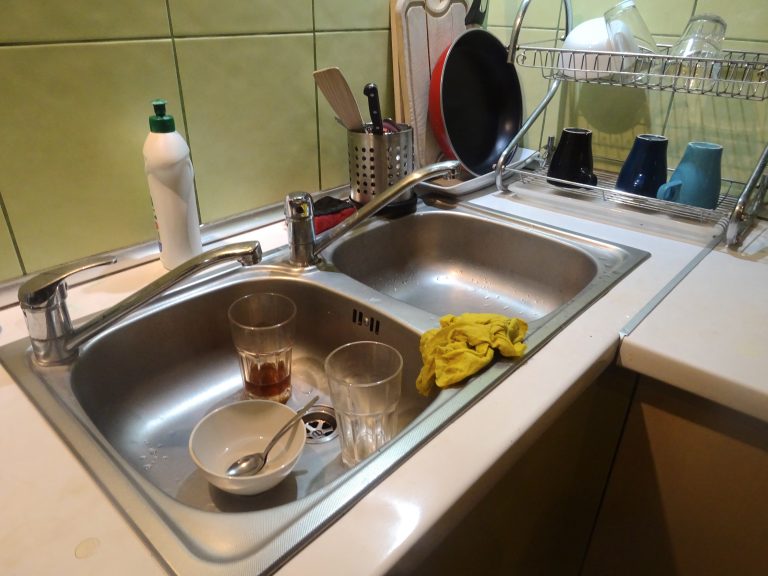
I want to click on bowl, so click(x=223, y=429), click(x=588, y=54).